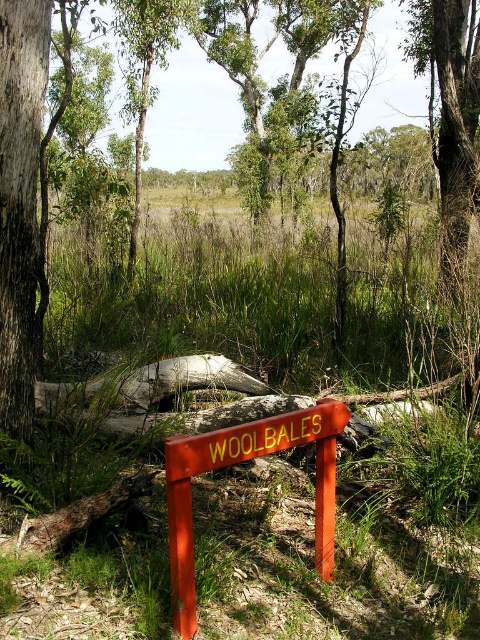
Consider the image. Is green grass at center thinner than orange painted wooden sign at center?

Incorrect, green grass at center's width is not less than orange painted wooden sign at center's.

Is green grass at center bigger than orange painted wooden sign at center?

Yes.

You are a GUI agent. You are given a task and a screenshot of the screen. Output one action in this format:
    pyautogui.click(x=<x>, y=<y>)
    Task: Click on the green grass at center
    The height and width of the screenshot is (640, 480).
    Given the screenshot: What is the action you would take?
    pyautogui.click(x=336, y=552)